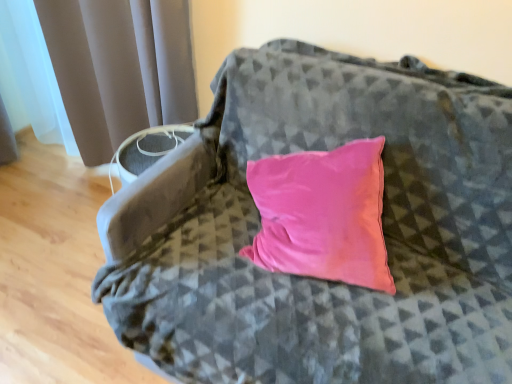
Question: In terms of width, does velvet pink pillow at center look wider or thinner when compared to satin gray curtain at left?

Choices:
 (A) thin
 (B) wide

Answer: (B)

Question: From the image's perspective, is velvet pink pillow at center above or below satin gray curtain at left?

Choices:
 (A) above
 (B) below

Answer: (B)

Question: In the image, is velvet pink pillow at center positioned in front of or behind satin gray curtain at left?

Choices:
 (A) front
 (B) behind

Answer: (A)

Question: Considering the positions of satin gray curtain at left and velvet pink pillow at center in the image, is satin gray curtain at left bigger or smaller than velvet pink pillow at center?

Choices:
 (A) big
 (B) small

Answer: (A)

Question: Considering the positions of satin gray curtain at left and velvet pink pillow at center in the image, is satin gray curtain at left wider or thinner than velvet pink pillow at center?

Choices:
 (A) wide
 (B) thin

Answer: (B)

Question: Do you think satin gray curtain at left is within velvet pink pillow at center, or outside of it?

Choices:
 (A) inside
 (B) outside

Answer: (B)

Question: In terms of height, does satin gray curtain at left look taller or shorter compared to velvet pink pillow at center?

Choices:
 (A) short
 (B) tall

Answer: (B)